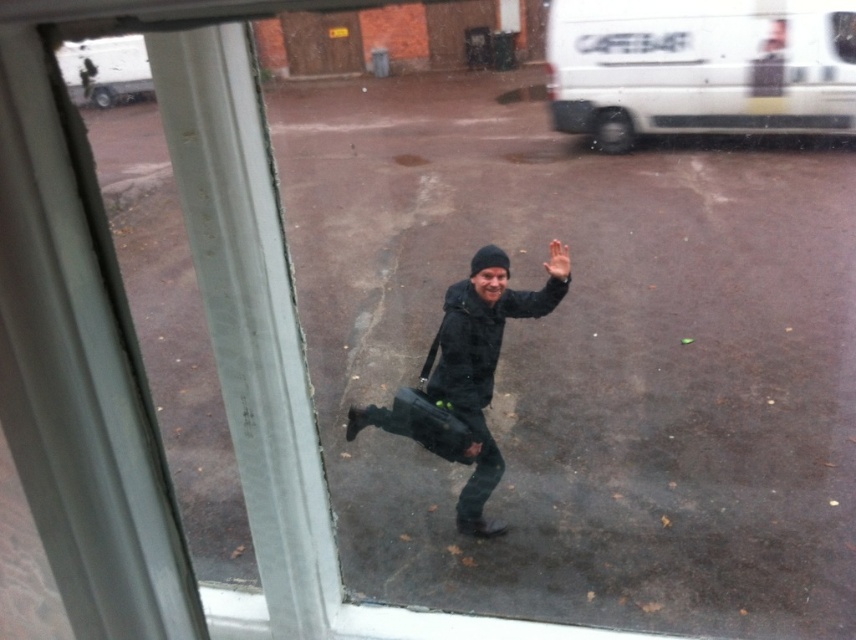
The image size is (856, 640). In order to click on black matte jacket at center in this screenshot , I will do `click(464, 380)`.

Does black matte jacket at center have a lesser width compared to brown wooden door at upper center?

Yes, black matte jacket at center is thinner than brown wooden door at upper center.

Identify the location of black matte jacket at center. (464, 380).

Does white matte van at upper right have a lesser width compared to matte skin hand at center?

No, white matte van at upper right is not thinner than matte skin hand at center.

Is point (825, 99) more distant than point (566, 273)?

Yes, it is behind point (566, 273).

Does point (708, 29) come behind point (568, 260)?

Yes, point (708, 29) is farther from viewer.

You are a GUI agent. You are given a task and a screenshot of the screen. Output one action in this format:
    pyautogui.click(x=<x>, y=<y>)
    Task: Click on the white matte van at upper right
    
    Given the screenshot: What is the action you would take?
    pyautogui.click(x=699, y=67)

Between point (378, 420) and point (563, 269), which one is positioned behind?

Point (378, 420)

Can you confirm if black matte jacket at center is shorter than matte skin hand at center?

Incorrect, black matte jacket at center's height does not fall short of matte skin hand at center's.

Does point (431, 417) lie behind point (550, 256)?

No, it is in front of (550, 256).

Identify the location of black matte jacket at center. (464, 380).